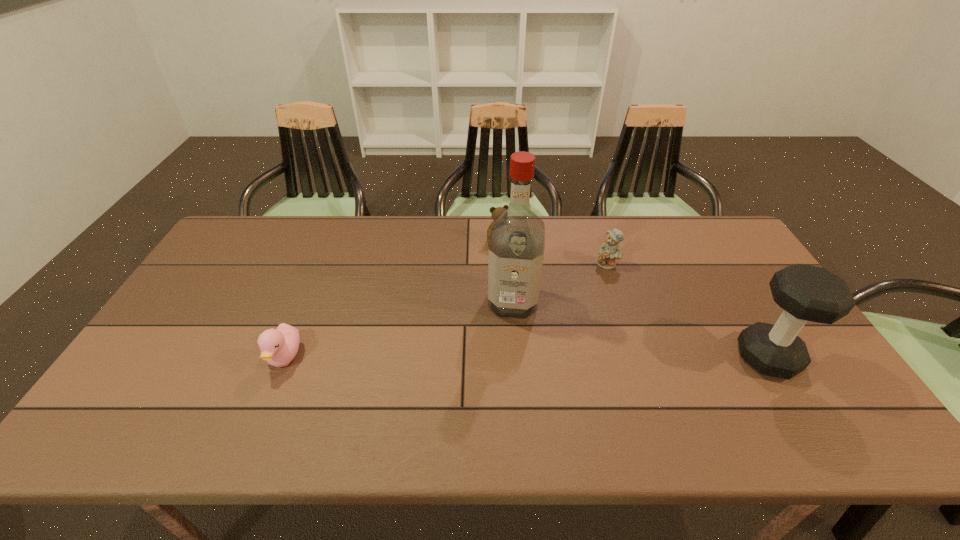
In order to click on the shortest object in this screenshot , I will do `click(279, 346)`.

This screenshot has width=960, height=540. What are the coordinates of `the leftmost object` in the screenshot? It's located at (279, 346).

This screenshot has width=960, height=540. I want to click on the fourth shortest object, so click(x=806, y=293).

Find the location of `the rightmost object`. the rightmost object is located at coordinates (806, 293).

Identify the location of the farther teddy bear. The width and height of the screenshot is (960, 540). coord(497,211).

I want to click on the farthest object, so click(x=497, y=211).

Where is `the nearer teddy bear`? Image resolution: width=960 pixels, height=540 pixels. the nearer teddy bear is located at coordinates (609, 251).

Image resolution: width=960 pixels, height=540 pixels. I want to click on the fourth nearest object, so click(609, 251).

You are a GUI agent. You are given a task and a screenshot of the screen. Output one action in this format:
    pyautogui.click(x=<x>, y=<y>)
    Task: Click on the tallest object
    
    Given the screenshot: What is the action you would take?
    pyautogui.click(x=517, y=239)

Where is `liquor`? This screenshot has height=540, width=960. liquor is located at coordinates (517, 239).